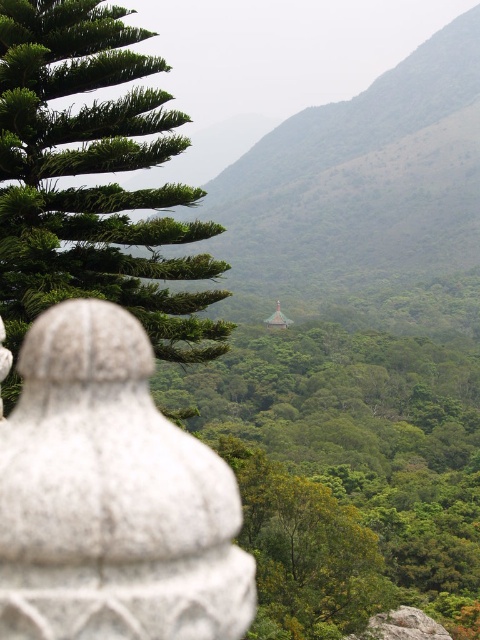
Question: Is green leafy tree at center above green leafy tree at upper left?

Choices:
 (A) no
 (B) yes

Answer: (A)

Question: Which object is farther from the camera taking this photo?

Choices:
 (A) green leafy tree at upper left
 (B) green leafy tree at center

Answer: (B)

Question: Does green leafy tree at center have a lesser width compared to green leafy tree at upper left?

Choices:
 (A) yes
 (B) no

Answer: (B)

Question: Among these points, which one is nearest to the camera?

Choices:
 (A) (64, 54)
 (B) (290, 541)

Answer: (A)

Question: Can you confirm if green leafy tree at center is positioned below green leafy tree at upper left?

Choices:
 (A) yes
 (B) no

Answer: (A)

Question: Among these points, which one is farthest from the camera?

Choices:
 (A) (44, 214)
 (B) (352, 340)

Answer: (B)